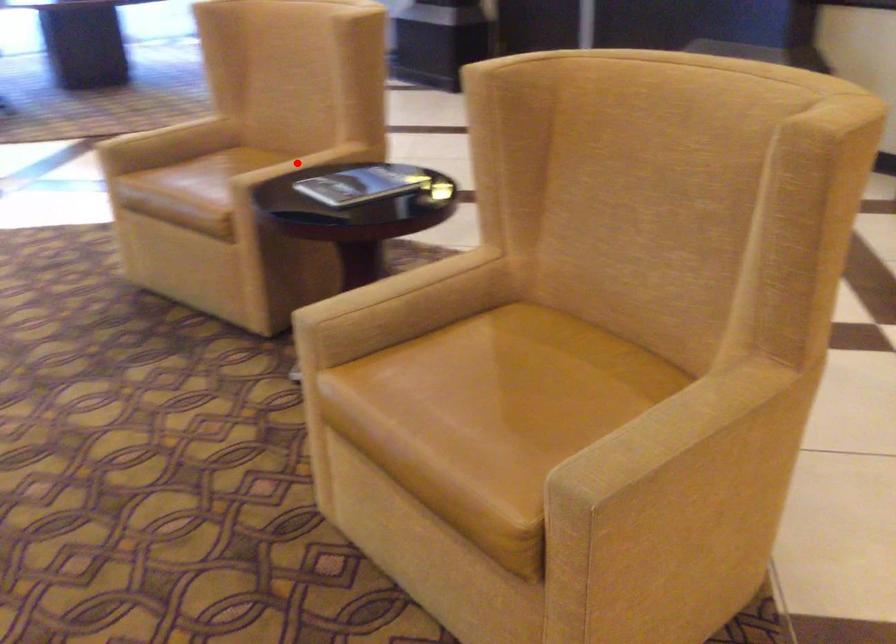
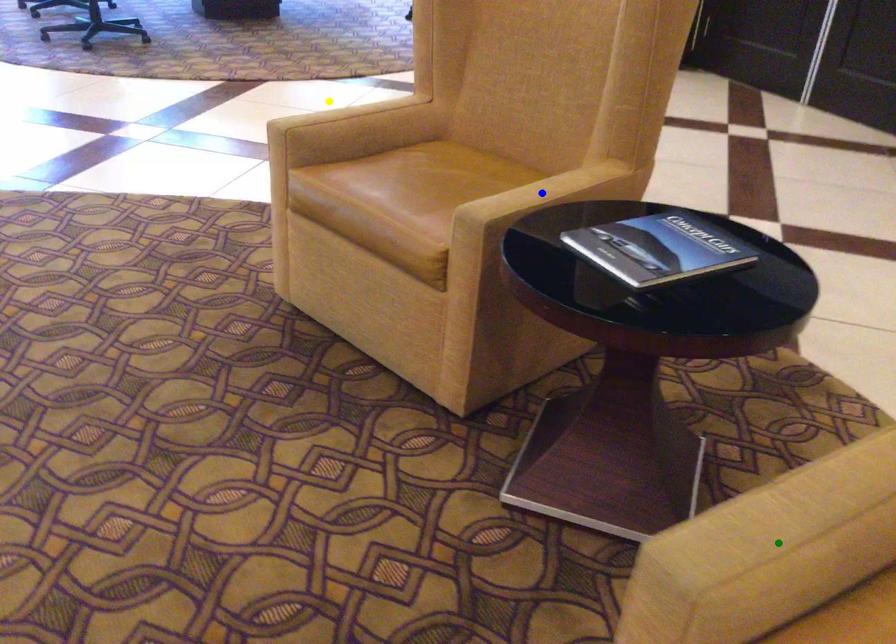
Question: I am providing you with two images of the same scene from different viewpoints. A red point is marked on the first image. You are given multiple points on the second image. In image 2, which mark is for the same physical point as the one in image 1?

Choices:
 (A) blue point
 (B) green point
 (C) yellow point

Answer: (A)